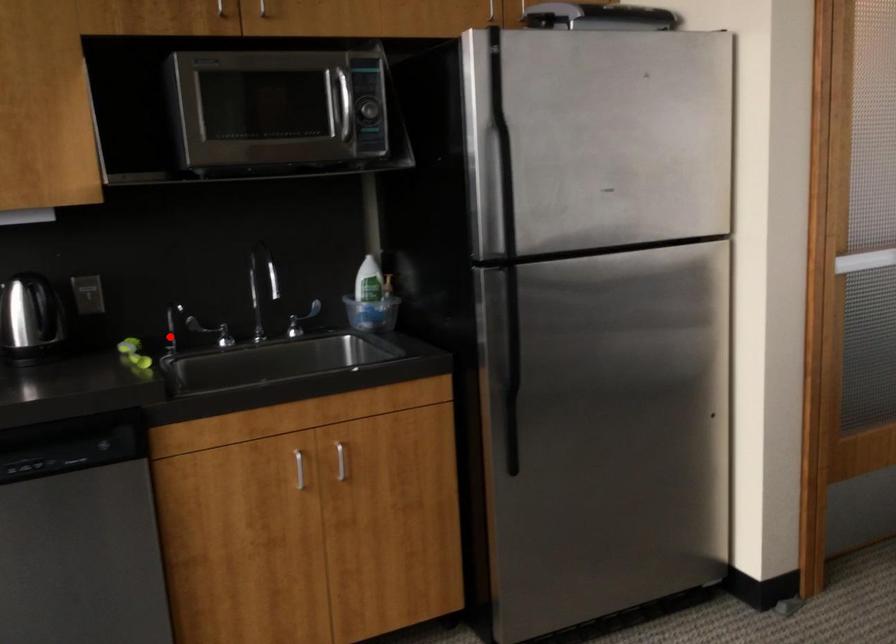
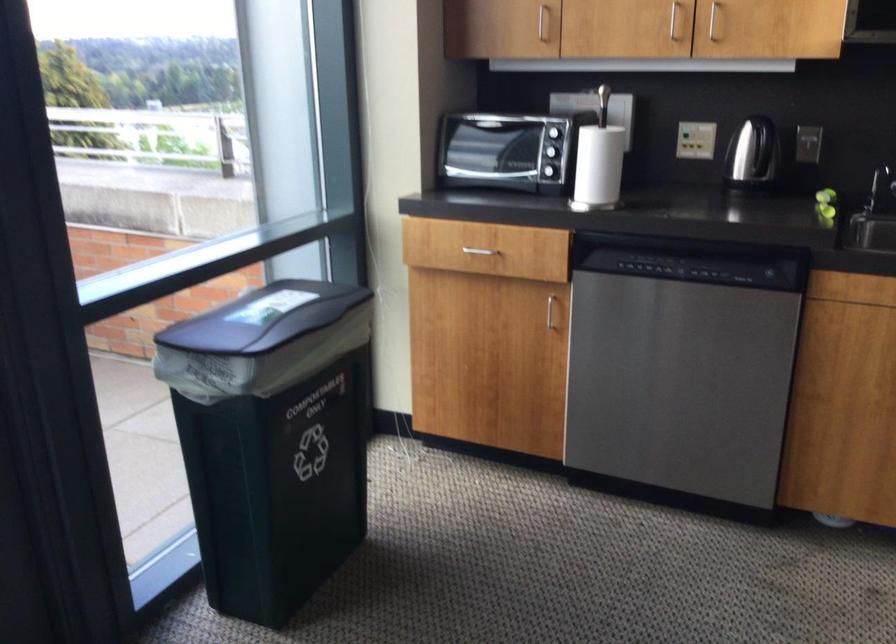
Where in the second image is the point corresponding to the highlighted location from the first image?

(879, 187)